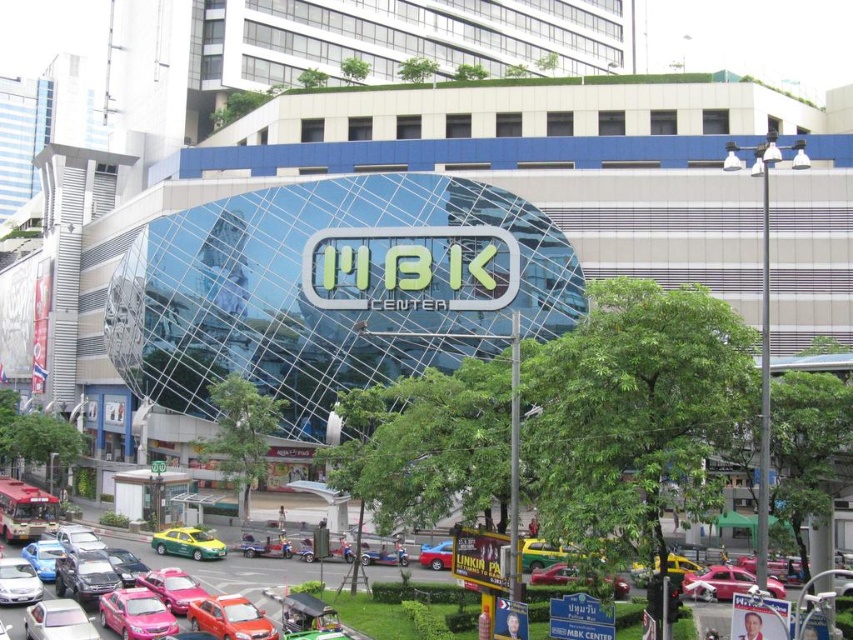
You are a pedestrian standing at the corner of the MBK Center and want to cross the street to the park on the other side. You see a green matte taxi at lower left and a metallic silver car at lower center. Which vehicle is closer to you in size?

The green matte taxi at lower left is smaller than the metallic silver car at lower center, so the metallic silver car at lower center is closer to your size as a pedestrian.

You are a delivery driver who needs to park your 2.5 meters wide truck near the MBK Center. You see a green matte taxi at lower left and a metallic silver car at lower center parked on the street. Which vehicle should you choose to park next to if you want to maximize the space between your truck and the other vehicles?

The green matte taxi at lower left has a smaller width than the metallic silver car at lower center. Therefore, parking next to the green matte taxi at lower left would leave more space between your truck and the other vehicle since it takes up less space.